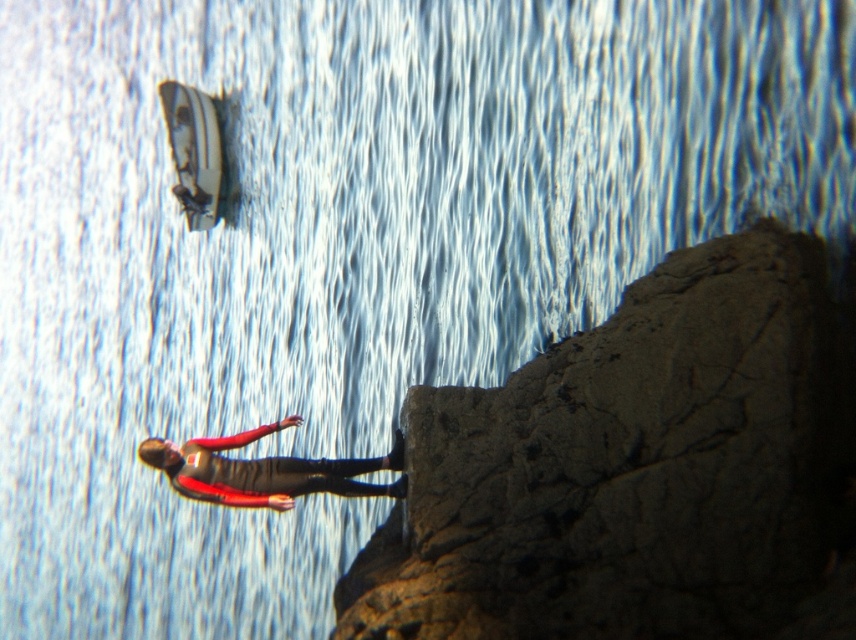
Question: Among these points, which one is nearest to the camera?

Choices:
 (A) (424, 592)
 (B) (274, 481)

Answer: (A)

Question: Does rough stone cliff at center appear on the left side of red fabric jacket at center?

Choices:
 (A) yes
 (B) no

Answer: (B)

Question: Which point is closer to the camera?

Choices:
 (A) red fabric jacket at center
 (B) rough stone cliff at center

Answer: (B)

Question: Does rough stone cliff at center have a greater width compared to red fabric jacket at center?

Choices:
 (A) no
 (B) yes

Answer: (B)

Question: In this image, where is rough stone cliff at center located relative to red fabric jacket at center?

Choices:
 (A) right
 (B) left

Answer: (A)